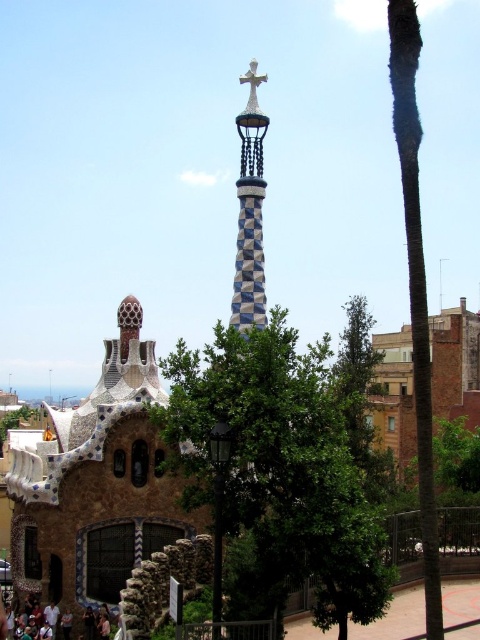
You are standing at the entrance of the architectural structure and want to take a photo of both the blue and white mosaic spire at center and the dark brown leather shoes at lower left. Can you capture both in one frame without moving your camera?

The blue and white mosaic spire at center is located above the dark brown leather leather shoes at lower left, so you can capture both in one frame without moving your camera as they are vertically aligned.

You are standing in front of the architectural structure and want to take a photo that includes both the green leafy palm tree at right and the gold metallic cross at upper center. Which object should you position lower in your camera frame?

The green leafy palm tree at right should be positioned lower in your camera frame because it is located below the gold metallic cross at upper center.